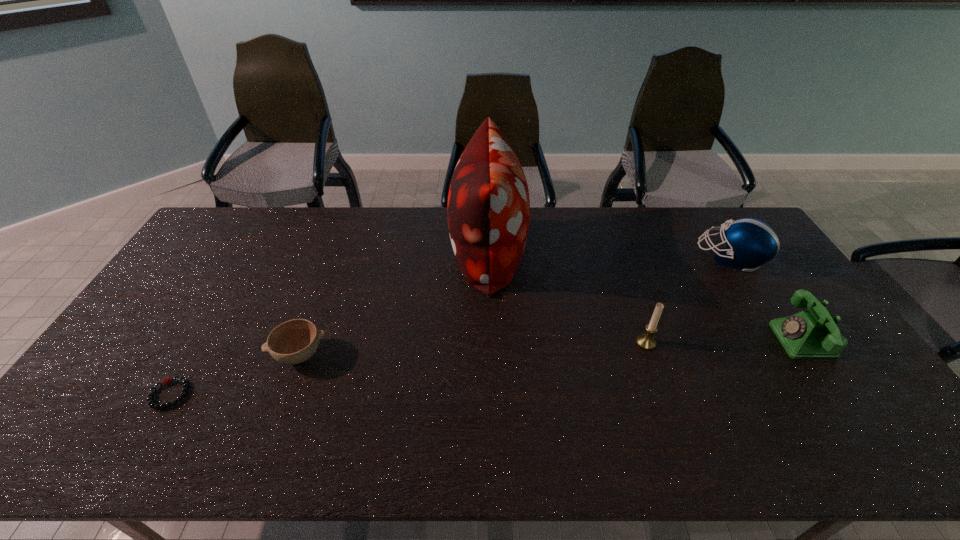
The width and height of the screenshot is (960, 540). Identify the location of free space between the candle holder and the third shortest object. (724, 341).

Locate an element on the screen. The height and width of the screenshot is (540, 960). object identified as the fourth closest to the fifth tallest object is located at coordinates (750, 242).

Locate an element on the screen. This screenshot has height=540, width=960. the fourth closest object to the fifth object from right to left is located at coordinates (750, 242).

Image resolution: width=960 pixels, height=540 pixels. Find the location of `vacant space that satisfies the following two spatial constraints: 1. on the front-facing side of the third object from left to right; 2. on the back side of the candle holder`. vacant space that satisfies the following two spatial constraints: 1. on the front-facing side of the third object from left to right; 2. on the back side of the candle holder is located at coordinates [490, 343].

Locate an element on the screen. vacant position in the image that satisfies the following two spatial constraints: 1. on the back side of the leftmost object; 2. on the left side of the bowl is located at coordinates (193, 354).

The width and height of the screenshot is (960, 540). Identify the location of free space that satisfies the following two spatial constraints: 1. at the front of the football helmet with the faceguard; 2. on the front side of the candle holder. (784, 343).

Image resolution: width=960 pixels, height=540 pixels. In order to click on free space that satisfies the following two spatial constraints: 1. at the front of the football helmet with the faceguard; 2. on the front side of the nearest object in this screenshot , I will do `click(817, 394)`.

Locate an element on the screen. This screenshot has width=960, height=540. free space in the image that satisfies the following two spatial constraints: 1. on the front-facing side of the third object from left to right; 2. on the left side of the candle holder is located at coordinates (490, 343).